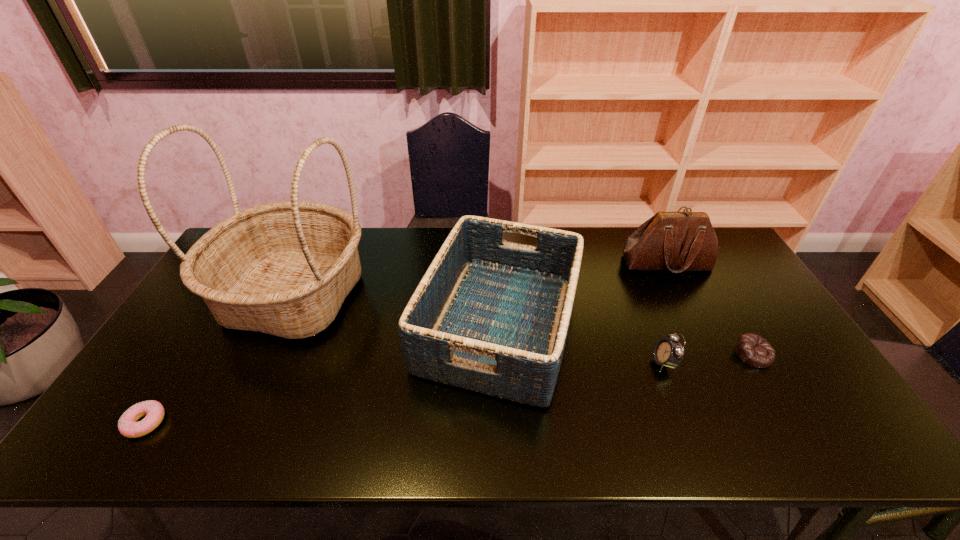
The height and width of the screenshot is (540, 960). Identify the location of free space between the second shortest object and the third tallest object. (627, 340).

This screenshot has width=960, height=540. Find the location of `free spot between the shorter basket and the shoulder bag`. free spot between the shorter basket and the shoulder bag is located at coordinates (583, 294).

Where is `vacant space that is in between the third object from left to right and the shoulder bag`? The image size is (960, 540). vacant space that is in between the third object from left to right and the shoulder bag is located at coordinates (583, 294).

Image resolution: width=960 pixels, height=540 pixels. Find the location of `vacant area between the shortest object and the taller basket`. vacant area between the shortest object and the taller basket is located at coordinates (220, 360).

At what (x,y) coordinates should I click in order to perform the action: click on object that is the fifth closest to the third object from left to right. Please return your answer as a coordinate pair (x, y). The height and width of the screenshot is (540, 960). Looking at the image, I should click on (128, 426).

Image resolution: width=960 pixels, height=540 pixels. I want to click on object that is the second nearest to the taller basket, so click(128, 426).

The height and width of the screenshot is (540, 960). I want to click on vacant space that satisfies the following two spatial constraints: 1. on the back side of the doughnut; 2. on the right side of the right basket, so click(207, 325).

Find the location of a particular element. This screenshot has height=540, width=960. free point that satisfies the following two spatial constraints: 1. on the back side of the doughnut; 2. on the left side of the right basket is located at coordinates (207, 325).

Image resolution: width=960 pixels, height=540 pixels. Find the location of `free location that satisfies the following two spatial constraints: 1. on the front side of the fifth tallest object; 2. on the left side of the taller basket`. free location that satisfies the following two spatial constraints: 1. on the front side of the fifth tallest object; 2. on the left side of the taller basket is located at coordinates (267, 355).